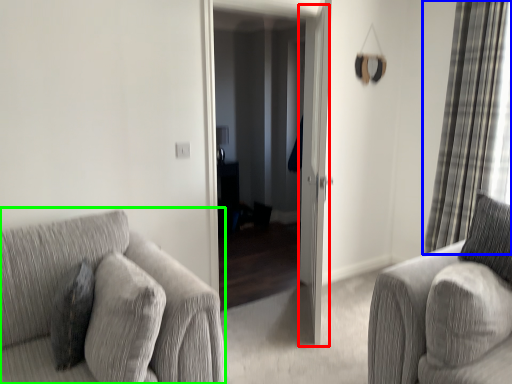
Question: Based on their relative distances, which object is farther from screen door (highlighted by a red box)? Choose from curtain (highlighted by a blue box) and studio couch (highlighted by a green box).

Choices:
 (A) curtain
 (B) studio couch

Answer: (B)